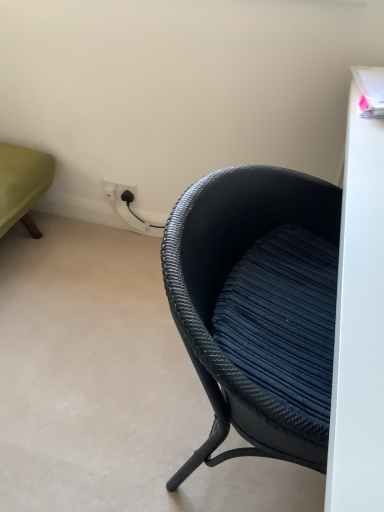
Where is `white plastic socket at upper left`? The width and height of the screenshot is (384, 512). white plastic socket at upper left is located at coordinates (119, 191).

What do you see at coordinates (119, 191) in the screenshot? I see `white plastic socket at upper left` at bounding box center [119, 191].

Where is `white plastic socket at upper left`? white plastic socket at upper left is located at coordinates tap(119, 191).